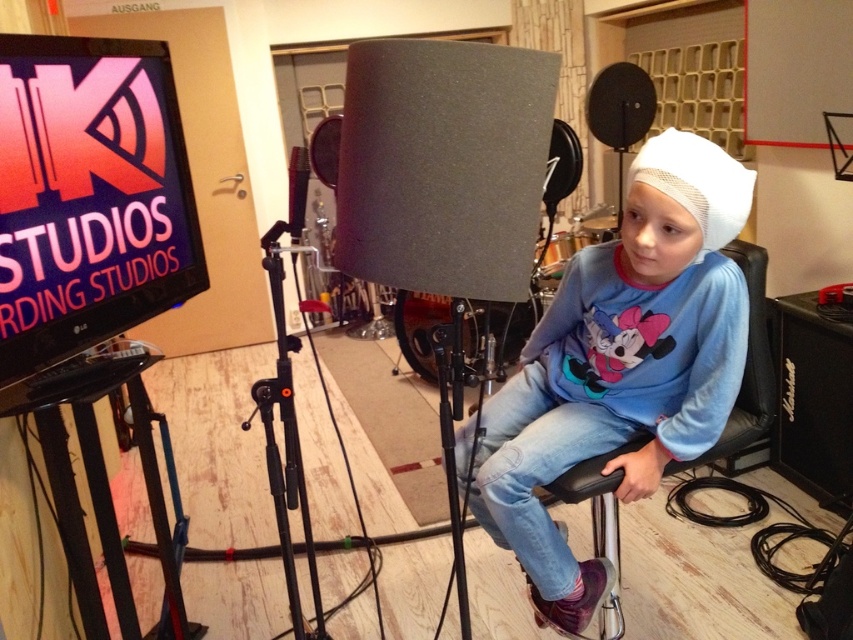
Does white mesh hat at center appear over black metal tripod at center?

Yes.

Does white mesh hat at center have a lesser height compared to black metal tripod at center?

No, white mesh hat at center is not shorter than black metal tripod at center.

Which is behind, point (611, 339) or point (296, 424)?

Point (296, 424)

Where is `white mesh hat at center`? white mesh hat at center is located at coordinates click(x=619, y=364).